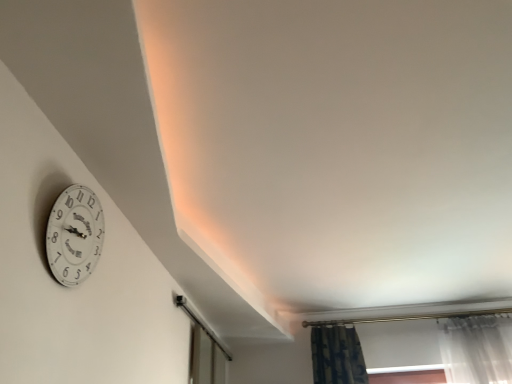
Measure the distance between point [209,371] and camera.

Point [209,371] and camera are 10.93 feet apart from each other.

Identify the location of transparent glass door at lower center. The height and width of the screenshot is (384, 512). (204, 352).

Image resolution: width=512 pixels, height=384 pixels. What do you see at coordinates (204, 352) in the screenshot?
I see `transparent glass door at lower center` at bounding box center [204, 352].

Image resolution: width=512 pixels, height=384 pixels. What do you see at coordinates (74, 235) in the screenshot? I see `white glossy clock at upper left` at bounding box center [74, 235].

You are a GUI agent. You are given a task and a screenshot of the screen. Output one action in this format:
    pyautogui.click(x=<x>, y=<y>)
    Task: Click on the white glossy clock at upper left
    
    Given the screenshot: What is the action you would take?
    pyautogui.click(x=74, y=235)

The width and height of the screenshot is (512, 384). Identify the location of transparent glass door at lower center. (204, 352).

Is transparent glass door at lower center to the left of white glossy clock at upper left from the viewer's perspective?

Incorrect, transparent glass door at lower center is not on the left side of white glossy clock at upper left.

Consider the image. Considering the positions of objects transparent glass door at lower center and white glossy clock at upper left in the image provided, who is in front, transparent glass door at lower center or white glossy clock at upper left?

white glossy clock at upper left is closer to the camera.

Which is less distant, (202, 361) or (65, 242)?

Point (202, 361) appears to be farther away from the viewer than point (65, 242).

From the image's perspective, which is below, transparent glass door at lower center or white glossy clock at upper left?

transparent glass door at lower center is shown below in the image.

From a real-world perspective, which is physically below, transparent glass door at lower center or white glossy clock at upper left?

In real-world perspective, white glossy clock at upper left is lower.

Which of these two, transparent glass door at lower center or white glossy clock at upper left, is wider?

transparent glass door at lower center is wider.

Which of these two, transparent glass door at lower center or white glossy clock at upper left, stands shorter?

With less height is transparent glass door at lower center.

Based on their sizes in the image, would you say transparent glass door at lower center is bigger or smaller than white glossy clock at upper left?

transparent glass door at lower center is bigger than white glossy clock at upper left.

Do you think transparent glass door at lower center is within white glossy clock at upper left, or outside of it?

transparent glass door at lower center lies outside white glossy clock at upper left.

Is transparent glass door at lower center not close to white glossy clock at upper left?

transparent glass door at lower center is positioned a significant distance from white glossy clock at upper left.

Is transparent glass door at lower center oriented towards white glossy clock at upper left?

No, transparent glass door at lower center is not turned towards white glossy clock at upper left.

Can you tell me how much transparent glass door at lower center and white glossy clock at upper left differ in facing direction?

0.548 degrees.

Find the location of a particular element. glass door on the right of white glossy clock at upper left is located at coordinates (204, 352).

Can you confirm if white glossy clock at upper left is positioned to the left of transparent glass door at lower center?

Yes.

Which object is more forward, white glossy clock at upper left or transparent glass door at lower center?

white glossy clock at upper left.

Based on the photo, which is closer to the camera, (98, 208) or (225, 361)?

Clearly, point (98, 208) is closer to the camera than point (225, 361).

From the image's perspective, relative to transparent glass door at lower center, is white glossy clock at upper left above or below?

white glossy clock at upper left is situated higher than transparent glass door at lower center in the image.

From a real-world perspective, is white glossy clock at upper left below transparent glass door at lower center?

Yes, from a real-world perspective, white glossy clock at upper left is under transparent glass door at lower center.

Between white glossy clock at upper left and transparent glass door at lower center, which one has larger width?

transparent glass door at lower center is wider.

Does white glossy clock at upper left have a greater height compared to transparent glass door at lower center?

Correct, white glossy clock at upper left is much taller as transparent glass door at lower center.

Considering the relative sizes of white glossy clock at upper left and transparent glass door at lower center in the image provided, is white glossy clock at upper left smaller than transparent glass door at lower center?

Yes, white glossy clock at upper left is smaller than transparent glass door at lower center.

Is white glossy clock at upper left spatially inside transparent glass door at lower center, or outside of it?

white glossy clock at upper left cannot be found inside transparent glass door at lower center.

Does white glossy clock at upper left touch transparent glass door at lower center?

They are not placed beside each other.

From the picture: Is white glossy clock at upper left facing away from transparent glass door at lower center?

No, white glossy clock at upper left is not facing the opposite direction of transparent glass door at lower center.

How different are the orientations of white glossy clock at upper left and transparent glass door at lower center in degrees?

white glossy clock at upper left and transparent glass door at lower center are facing 0.548 degrees away from each other.

Identify the location of glass door on the right of white glossy clock at upper left. (204, 352).

You are a GUI agent. You are given a task and a screenshot of the screen. Output one action in this format:
    pyautogui.click(x=<x>, y=<y>)
    Task: Click on the wall clock that appears below the transparent glass door at lower center (from a real-world perspective)
    The height and width of the screenshot is (384, 512).
    Given the screenshot: What is the action you would take?
    pyautogui.click(x=74, y=235)

Locate an element on the screen. The image size is (512, 384). wall clock in front of the transparent glass door at lower center is located at coordinates (74, 235).